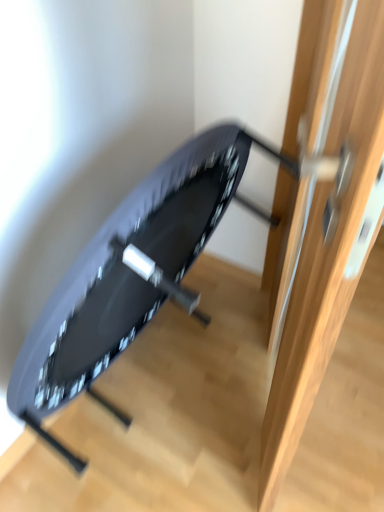
Question: Would you say wooden door at center is part of matte black swivel chair at center's contents?

Choices:
 (A) no
 (B) yes

Answer: (A)

Question: Is matte black swivel chair at center outside of wooden door at center?

Choices:
 (A) yes
 (B) no

Answer: (A)

Question: From the image's perspective, is matte black swivel chair at center on top of wooden door at center?

Choices:
 (A) yes
 (B) no

Answer: (B)

Question: Is matte black swivel chair at center at the right side of wooden door at center?

Choices:
 (A) yes
 (B) no

Answer: (B)

Question: Are matte black swivel chair at center and wooden door at center beside each other?

Choices:
 (A) no
 (B) yes

Answer: (A)

Question: Is matte black swivel chair at center looking in the opposite direction of wooden door at center?

Choices:
 (A) yes
 (B) no

Answer: (B)

Question: Is wooden door at center at the right side of matte black swivel chair at center?

Choices:
 (A) no
 (B) yes

Answer: (B)

Question: Are wooden door at center and matte black swivel chair at center making contact?

Choices:
 (A) yes
 (B) no

Answer: (B)

Question: From the image's perspective, is wooden door at center above matte black swivel chair at center?

Choices:
 (A) no
 (B) yes

Answer: (B)

Question: Considering the relative positions of wooden door at center and matte black swivel chair at center in the image provided, is wooden door at center in front of matte black swivel chair at center?

Choices:
 (A) yes
 (B) no

Answer: (A)

Question: Is matte black swivel chair at center surrounded by wooden door at center?

Choices:
 (A) no
 (B) yes

Answer: (A)

Question: Could you tell me if wooden door at center is turned towards matte black swivel chair at center?

Choices:
 (A) no
 (B) yes

Answer: (A)

Question: Is wooden door at center taller or shorter than matte black swivel chair at center?

Choices:
 (A) tall
 (B) short

Answer: (A)